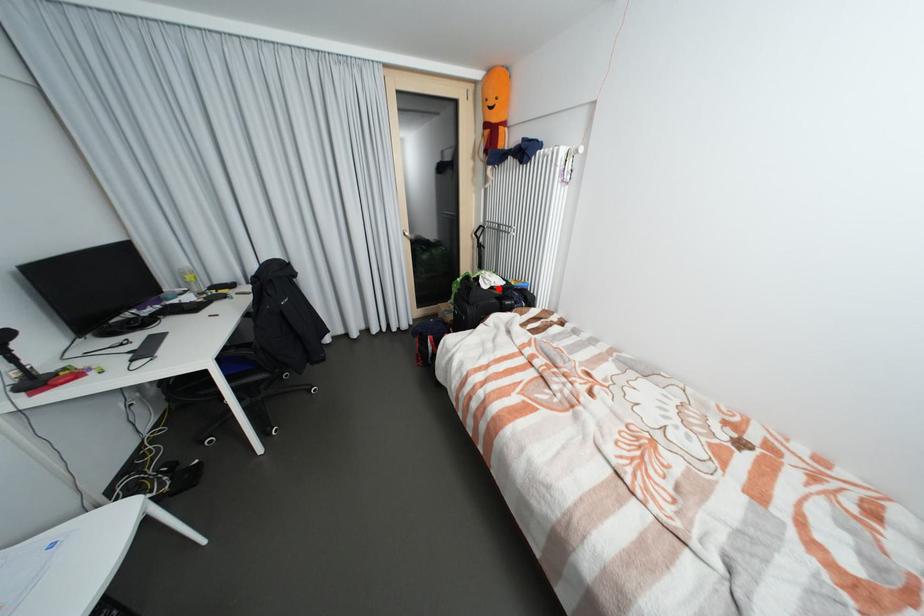
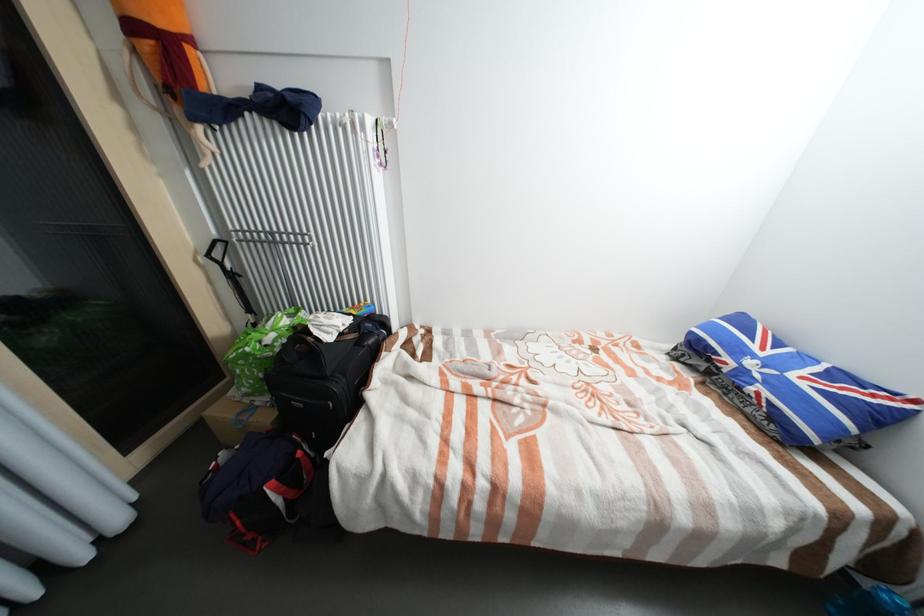
In the second image, find the point that corresponds to the highlighted location in the first image.

(348, 334)